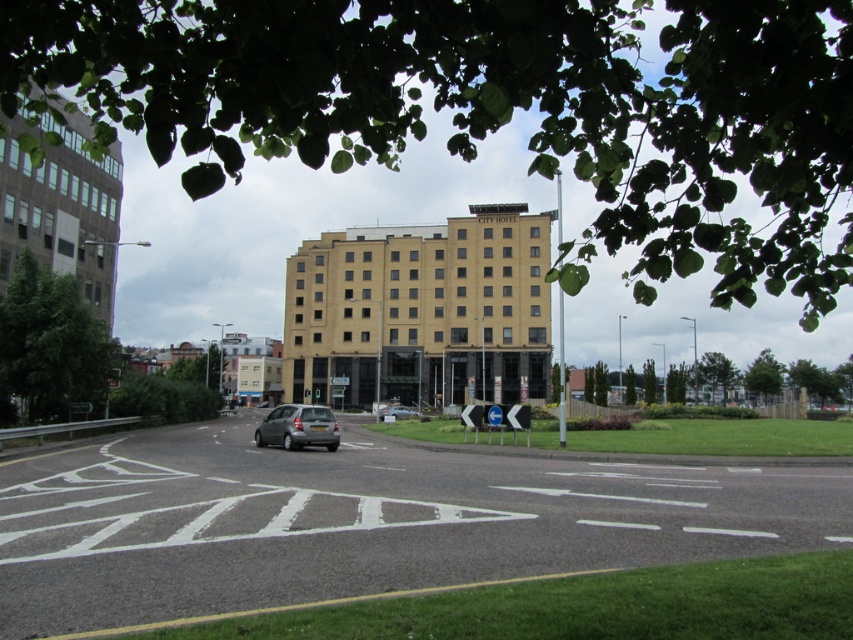
Is glassy reflective building at left closer to camera compared to silver metallic car at center?

Yes, it is in front of silver metallic car at center.

In the scene shown: Measure the distance between glassy reflective building at left and camera.

glassy reflective building at left is 12.40 feet away from camera.

Image resolution: width=853 pixels, height=640 pixels. What do you see at coordinates (61, 208) in the screenshot?
I see `glassy reflective building at left` at bounding box center [61, 208].

Locate an element on the screen. glassy reflective building at left is located at coordinates (61, 208).

Is point (442, 246) positioned behind point (407, 417)?

Yes, point (442, 246) is behind point (407, 417).

Who is lower down, yellow brick building at center or silver metallic car at center?

Positioned lower is silver metallic car at center.

Who is more distant from viewer, (436, 381) or (387, 408)?

The point (436, 381) is more distant.

What are the coordinates of `yellow brick building at center` in the screenshot? It's located at (421, 310).

Which is behind, point (436, 289) or point (297, 442)?

The point (436, 289) is behind.

Does point (538, 285) come in front of point (267, 433)?

No, (538, 285) is further to viewer.

Who is more forward, (413, 292) or (283, 406)?

Point (283, 406) is more forward.

The image size is (853, 640). I want to click on yellow brick building at center, so click(421, 310).